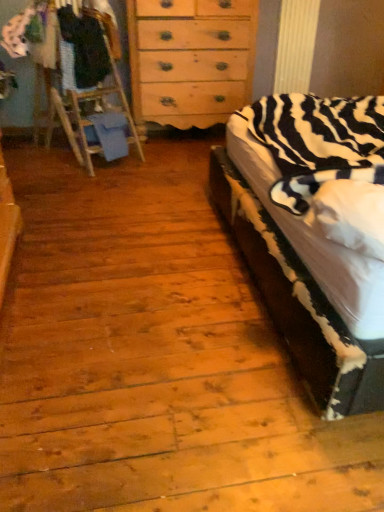
Question: Can you confirm if white cotton shirt at upper left, placed as the 2th clothing when sorted from right to left, is shorter than dark blue fabric at left, the 1th clothing from the right?

Choices:
 (A) yes
 (B) no

Answer: (A)

Question: From the image's perspective, does white cotton shirt at upper left, placed as the 2th clothing when sorted from right to left, appear lower than dark blue fabric at left, the 1th clothing from the right?

Choices:
 (A) no
 (B) yes

Answer: (A)

Question: Does white cotton shirt at upper left, placed as the 2th clothing when sorted from right to left, come in front of dark blue fabric at left, the 1th clothing from the right?

Choices:
 (A) no
 (B) yes

Answer: (A)

Question: Does white cotton shirt at upper left, placed as the 2th clothing when sorted from right to left, appear on the left side of dark blue fabric at left, the 2th clothing when ordered from left to right?

Choices:
 (A) no
 (B) yes

Answer: (B)

Question: Is white cotton shirt at upper left, placed as the 2th clothing when sorted from right to left, aimed at dark blue fabric at left, the 1th clothing from the right?

Choices:
 (A) yes
 (B) no

Answer: (A)

Question: In the image, is white cotton shirt at upper left, arranged as the first clothing when viewed from the left, on the left side or the right side of zebra-patterned fabric at right?

Choices:
 (A) left
 (B) right

Answer: (A)

Question: Considering their positions, is white cotton shirt at upper left, placed as the 2th clothing when sorted from right to left, located in front of or behind zebra-patterned fabric at right?

Choices:
 (A) front
 (B) behind

Answer: (B)

Question: In terms of height, does white cotton shirt at upper left, placed as the 2th clothing when sorted from right to left, look taller or shorter compared to zebra-patterned fabric at right?

Choices:
 (A) tall
 (B) short

Answer: (B)

Question: Looking at the image, does white cotton shirt at upper left, arranged as the first clothing when viewed from the left, seem bigger or smaller compared to zebra-patterned fabric at right?

Choices:
 (A) big
 (B) small

Answer: (B)

Question: From the image's perspective, is dark blue fabric at left, the 2th clothing when ordered from left to right, positioned above or below light brown wooden dresser at center?

Choices:
 (A) below
 (B) above

Answer: (A)

Question: From a real-world perspective, is dark blue fabric at left, the 1th clothing from the right, positioned above or below light brown wooden dresser at center?

Choices:
 (A) below
 (B) above

Answer: (B)

Question: Looking at the image, does dark blue fabric at left, the 2th clothing when ordered from left to right, seem bigger or smaller compared to light brown wooden dresser at center?

Choices:
 (A) small
 (B) big

Answer: (A)

Question: Is dark blue fabric at left, the 2th clothing when ordered from left to right, situated inside light brown wooden dresser at center or outside?

Choices:
 (A) outside
 (B) inside

Answer: (A)

Question: From a real-world perspective, is dark blue fabric at left, the 1th clothing from the right, above or below white cotton shirt at upper left, arranged as the first clothing when viewed from the left?

Choices:
 (A) above
 (B) below

Answer: (B)

Question: Is dark blue fabric at left, the 2th clothing when ordered from left to right, bigger or smaller than white cotton shirt at upper left, placed as the 2th clothing when sorted from right to left?

Choices:
 (A) small
 (B) big

Answer: (B)